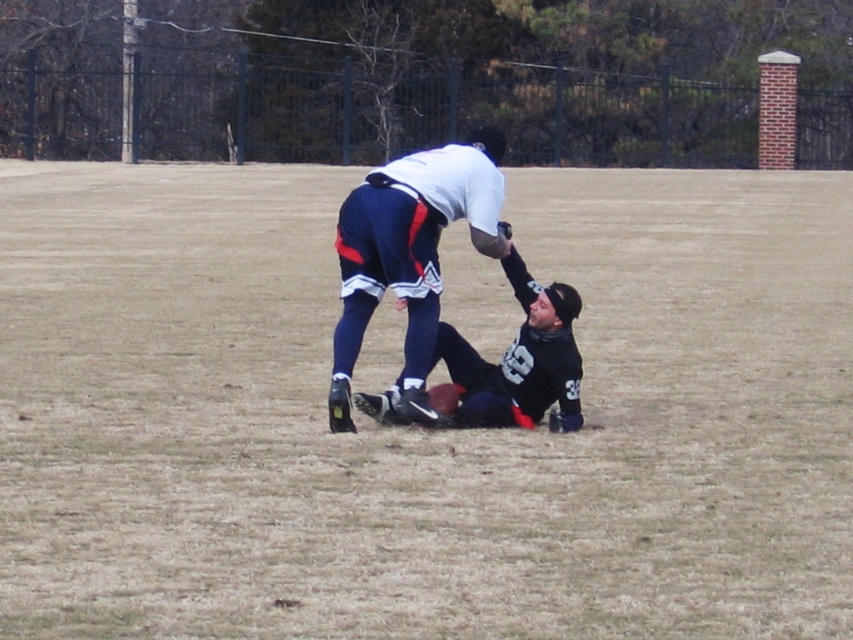
You are a referee observing the scene. You notice the brown grass at center and the white matte shirt at center. Which object is located lower in the image?

The brown grass at center is located lower in the image than the white matte shirt at center because the brown grass at center is below white matte shirt at center.

Based on the photo, you are a photographer trying to capture a closeup of the black jersey at center without including the brown grass at center in the frame. Is this possible given their sizes?

The brown grass at center is bigger than the black jersey at center. Since the grass is larger, it might be challenging to frame the jersey without including some grass, but if positioned correctly, focusing tightly on the jersey could exclude the grass.